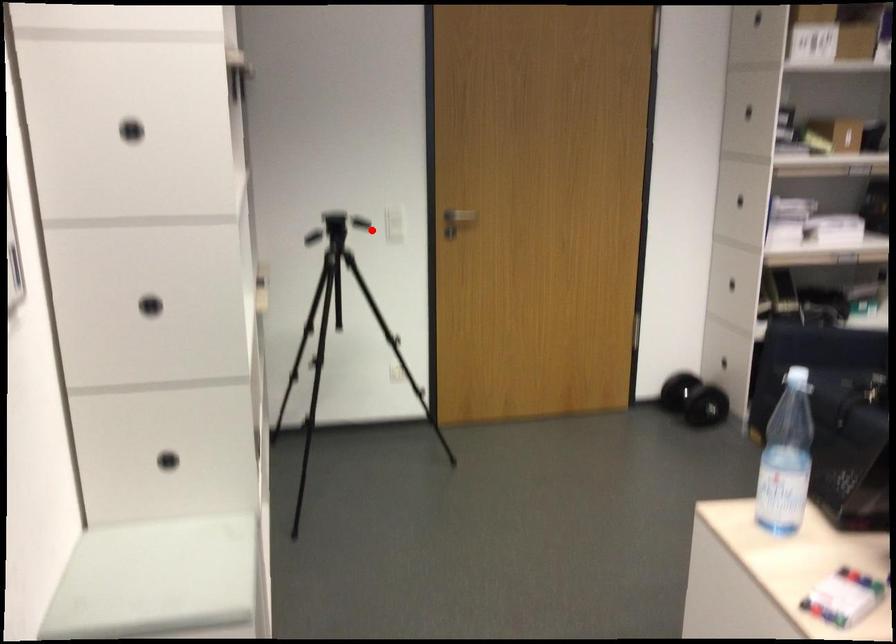
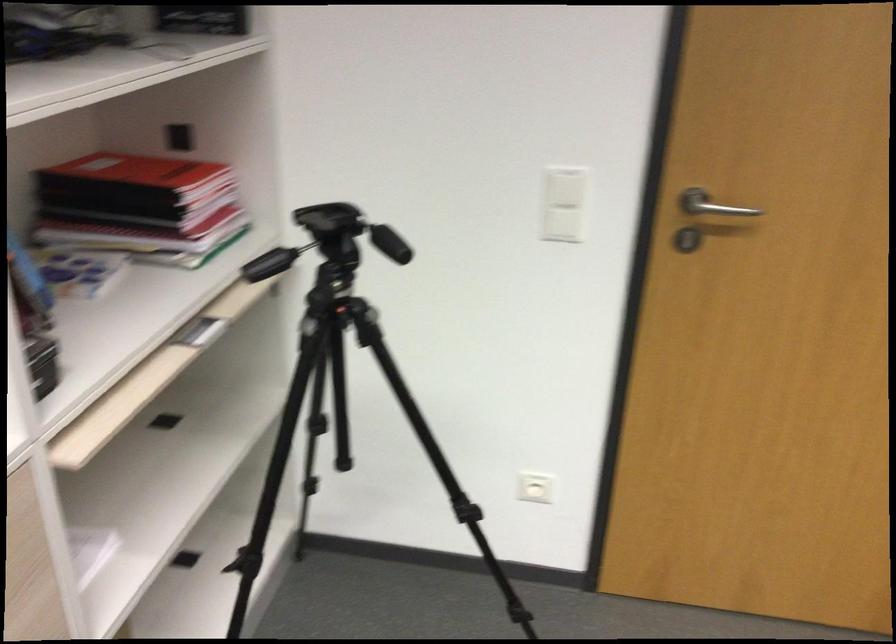
In the second image, find the point that corresponds to the highlighted location in the first image.

(563, 225)